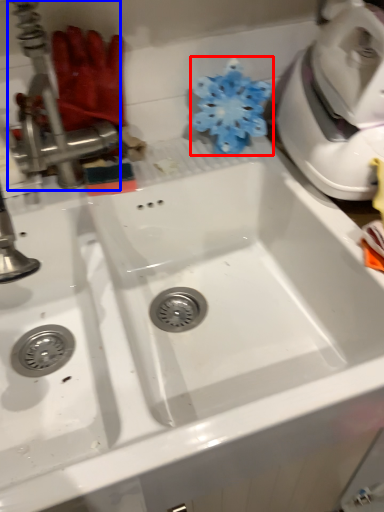
Question: Which object is closer to the camera taking this photo, flower (highlighted by a red box) or tap (highlighted by a blue box)?

Choices:
 (A) flower
 (B) tap

Answer: (B)